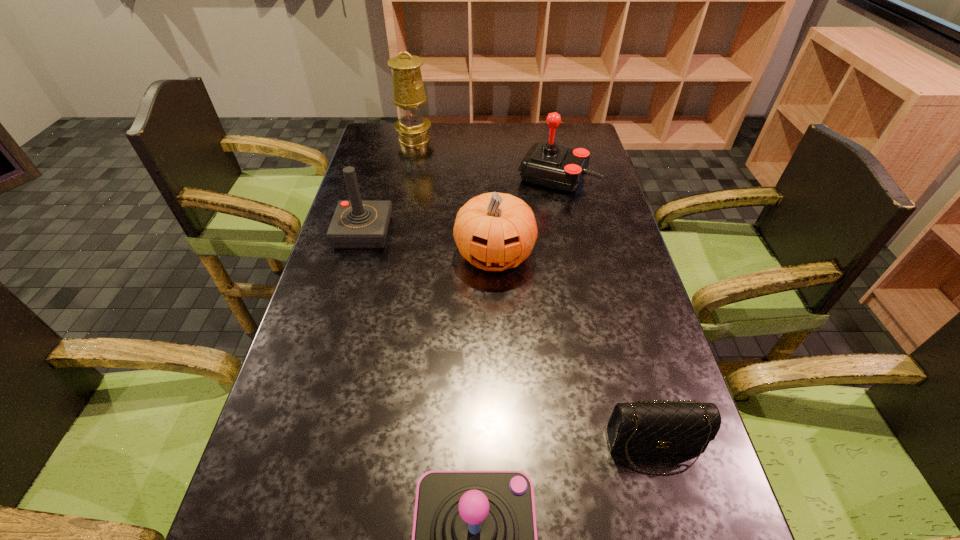
Identify the location of vacant space situated on the front-facing side of the pumpkin. This screenshot has width=960, height=540. (496, 320).

The height and width of the screenshot is (540, 960). Identify the location of vacant space situated 0.060m on the front flap of the clutch bag. (672, 510).

Locate an element on the screen. Image resolution: width=960 pixels, height=540 pixels. object present at the far edge is located at coordinates (408, 90).

Where is `oil lamp located in the left edge section of the desktop`? This screenshot has width=960, height=540. oil lamp located in the left edge section of the desktop is located at coordinates (408, 90).

This screenshot has height=540, width=960. In order to click on joystick that is at the left edge in this screenshot , I will do `click(356, 224)`.

This screenshot has width=960, height=540. I want to click on joystick situated at the right edge, so click(x=547, y=164).

Find the location of `clutch bag positioned at the right edge`. clutch bag positioned at the right edge is located at coordinates (648, 427).

Where is `object that is at the far left corner`? The width and height of the screenshot is (960, 540). object that is at the far left corner is located at coordinates (408, 90).

In the image, there is a desktop. Where is `blank space at the far edge`? blank space at the far edge is located at coordinates (522, 146).

This screenshot has width=960, height=540. Identify the location of vacant area at the left edge of the desktop. (367, 275).